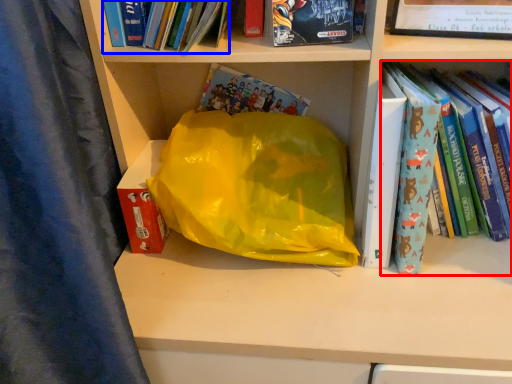
Question: Among these objects, which one is nearest to the camera, book (highlighted by a red box) or book (highlighted by a blue box)?

Choices:
 (A) book
 (B) book

Answer: (B)